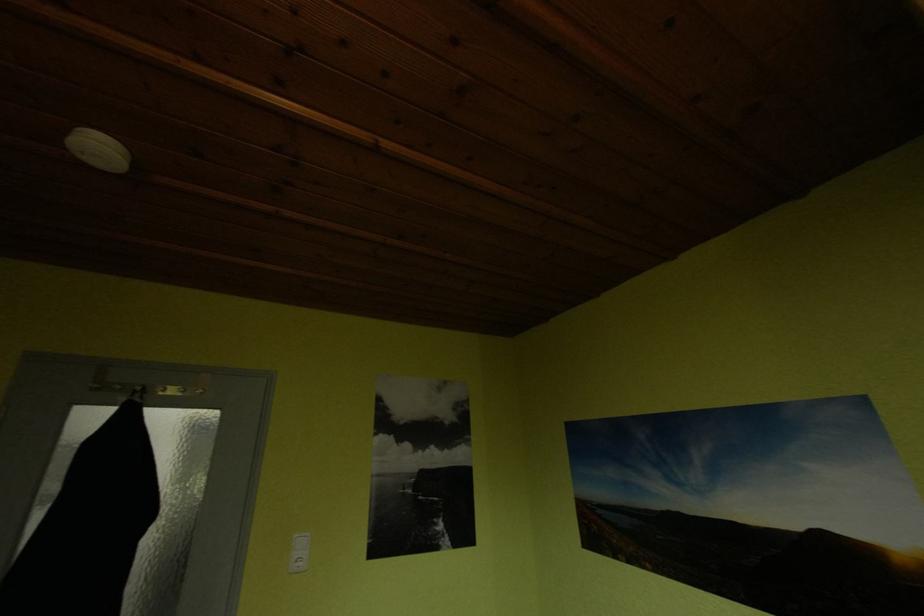
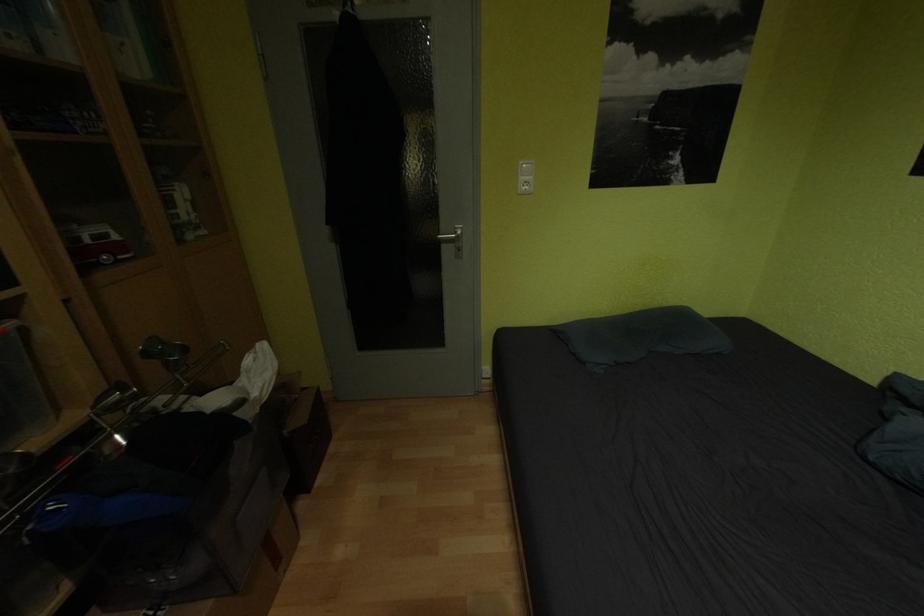
How did the camera likely rotate?

The rotation direction of the camera is left-down.